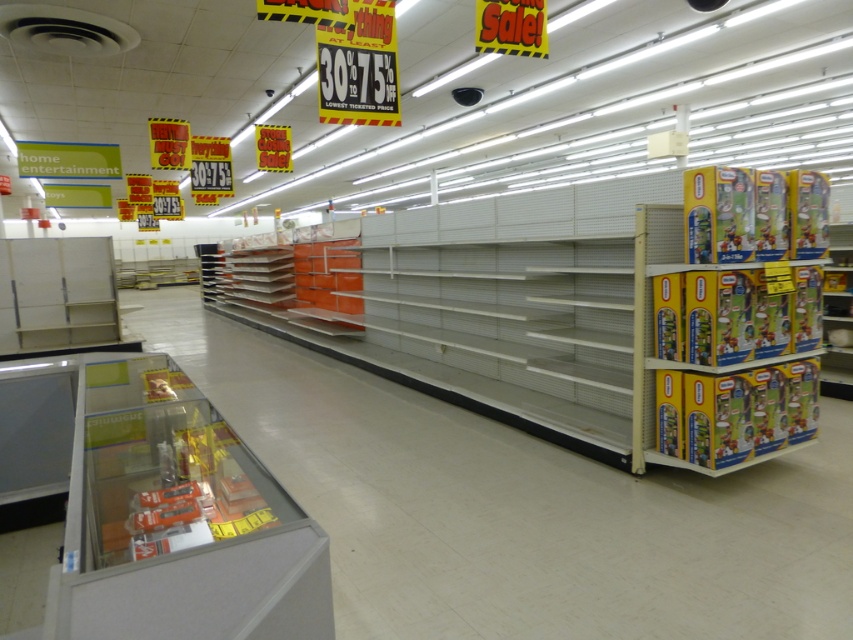
Question: Which point is farther to the camera?

Choices:
 (A) (155, 493)
 (B) (785, 401)

Answer: (B)

Question: Considering the relative positions of clear plastic display case at lower left and yellow cardboard toy at right in the image provided, where is clear plastic display case at lower left located with respect to yellow cardboard toy at right?

Choices:
 (A) below
 (B) above

Answer: (A)

Question: Estimate the real-world distances between objects in this image. Which object is farther from the clear plastic display case at lower left?

Choices:
 (A) yellow cardboard boxes at right
 (B) yellow cardboard toy at right

Answer: (B)

Question: Which point appears farthest from the camera in this image?

Choices:
 (A) (65, 536)
 (B) (817, 232)
 (C) (744, 394)

Answer: (B)

Question: Can you confirm if yellow cardboard toy at right is positioned to the right of yellow cardboard boxes at right?

Choices:
 (A) no
 (B) yes

Answer: (B)

Question: Can you confirm if yellow cardboard toy at right is positioned to the left of yellow cardboard boxes at right?

Choices:
 (A) no
 (B) yes

Answer: (A)